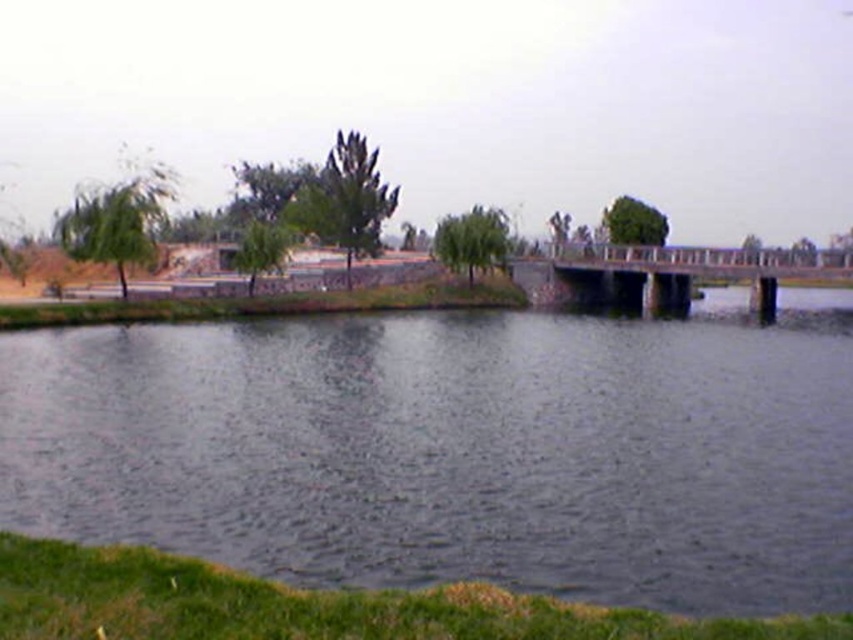
Is dark blue water at center to the left of concrete bridge at center from the viewer's perspective?

Indeed, dark blue water at center is positioned on the left side of concrete bridge at center.

Describe the element at coordinates (457, 449) in the screenshot. I see `dark blue water at center` at that location.

The height and width of the screenshot is (640, 853). Identify the location of dark blue water at center. click(x=457, y=449).